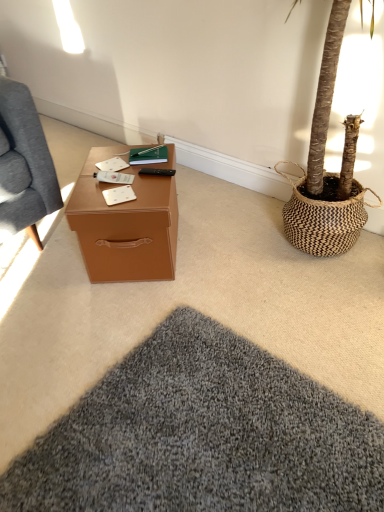
Find the location of `vacant region to the left of brown leather desk at center`. vacant region to the left of brown leather desk at center is located at coordinates (45, 271).